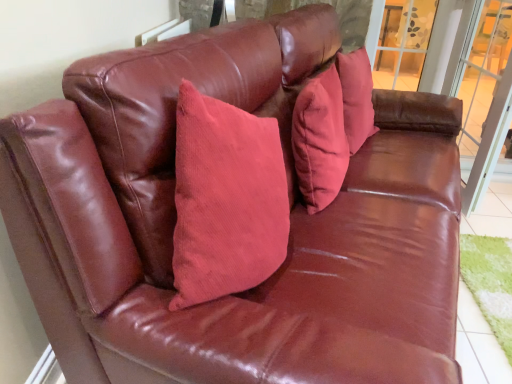
Question: From a real-world perspective, is transparent glass screen door at right under clear glass window at upper right?

Choices:
 (A) yes
 (B) no

Answer: (B)

Question: Is clear glass window at upper right completely or partially inside transparent glass screen door at right?

Choices:
 (A) no
 (B) yes

Answer: (A)

Question: Does transparent glass screen door at right come behind clear glass window at upper right?

Choices:
 (A) no
 (B) yes

Answer: (A)

Question: Can you see transparent glass screen door at right touching clear glass window at upper right?

Choices:
 (A) no
 (B) yes

Answer: (A)

Question: Considering the relative positions of transparent glass screen door at right and clear glass window at upper right in the image provided, is transparent glass screen door at right to the left of clear glass window at upper right from the viewer's perspective?

Choices:
 (A) yes
 (B) no

Answer: (A)

Question: Is transparent glass screen door at right taller or shorter than corduroy pillow at center?

Choices:
 (A) tall
 (B) short

Answer: (A)

Question: Looking at the image, does transparent glass screen door at right seem bigger or smaller compared to corduroy pillow at center?

Choices:
 (A) big
 (B) small

Answer: (A)

Question: Looking at their shapes, would you say transparent glass screen door at right is wider or thinner than corduroy pillow at center?

Choices:
 (A) thin
 (B) wide

Answer: (B)

Question: Is transparent glass screen door at right spatially inside corduroy pillow at center, or outside of it?

Choices:
 (A) inside
 (B) outside

Answer: (B)

Question: In terms of height, does transparent glass screen door at right look taller or shorter compared to clear glass window at upper right?

Choices:
 (A) short
 (B) tall

Answer: (B)

Question: Looking at the image, does transparent glass screen door at right seem bigger or smaller compared to clear glass window at upper right?

Choices:
 (A) big
 (B) small

Answer: (B)

Question: Is transparent glass screen door at right wider or thinner than clear glass window at upper right?

Choices:
 (A) thin
 (B) wide

Answer: (A)

Question: Is point (498, 29) positioned closer to the camera than point (394, 18)?

Choices:
 (A) farther
 (B) closer

Answer: (B)

Question: From a real-world perspective, is clear glass window at upper right physically located above or below transparent glass screen door at right?

Choices:
 (A) above
 (B) below

Answer: (B)

Question: Relative to transparent glass screen door at right, is clear glass window at upper right in front or behind?

Choices:
 (A) front
 (B) behind

Answer: (B)